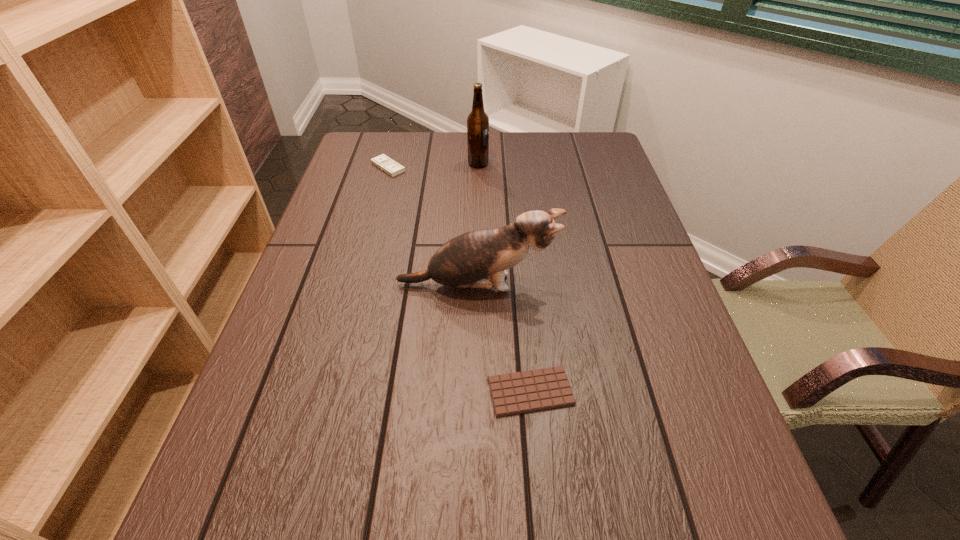
Image resolution: width=960 pixels, height=540 pixels. What are the coordinates of `object that is the second closest to the tallest object` in the screenshot? It's located at (462, 262).

Locate an element on the screen. The width and height of the screenshot is (960, 540). free region that satisfies the following two spatial constraints: 1. at the face of the second tallest object; 2. on the left side of the chocolate bar is located at coordinates (476, 392).

The image size is (960, 540). In order to click on blank area in the image that satisfies the following two spatial constraints: 1. at the face of the cat; 2. on the back side of the chocolate bar in this screenshot , I will do `click(476, 392)`.

You are a GUI agent. You are given a task and a screenshot of the screen. Output one action in this format:
    pyautogui.click(x=<x>, y=<y>)
    Task: Click on the blank area in the image that satisfies the following two spatial constraints: 1. at the face of the third shortest object; 2. on the back side of the shortest object
    The width and height of the screenshot is (960, 540).
    Given the screenshot: What is the action you would take?
    (476, 392)

This screenshot has width=960, height=540. In order to click on vacant space that satisfies the following two spatial constraints: 1. on the label of the nearest object; 2. on the left side of the tallest object in this screenshot , I will do `click(477, 392)`.